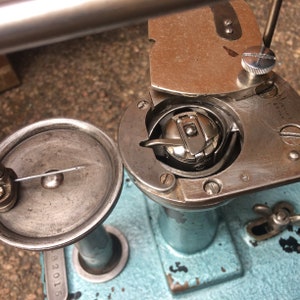
I want to click on paint, so click(x=149, y=243).